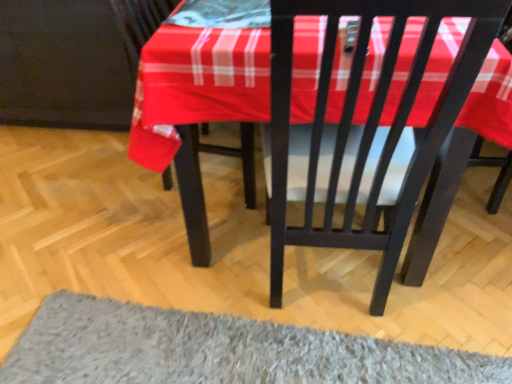
What is the approximate height of gray textured rug at lower center?

The height of gray textured rug at lower center is 2.36 inches.

Identify the location of gray textured rug at lower center. This screenshot has width=512, height=384. (218, 350).

Describe the element at coordinates (218, 350) in the screenshot. The width and height of the screenshot is (512, 384). I see `gray textured rug at lower center` at that location.

Image resolution: width=512 pixels, height=384 pixels. Find the location of `gray textured rug at lower center`. gray textured rug at lower center is located at coordinates (218, 350).